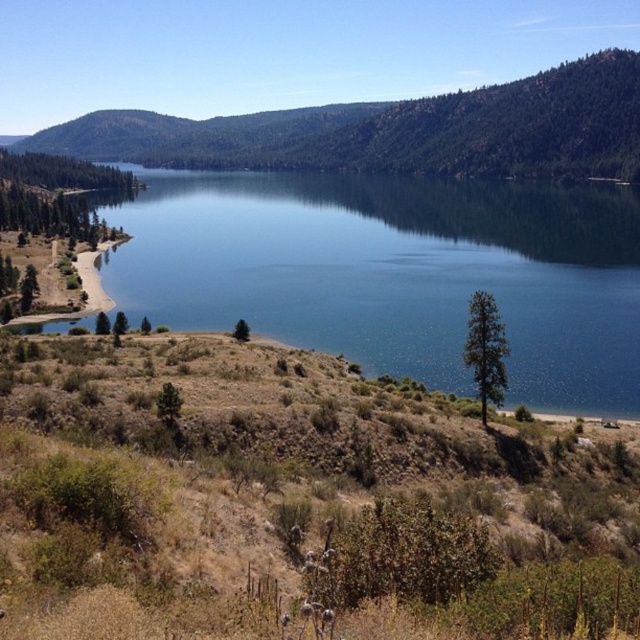
Question: Can you confirm if blue reflective water at center is smaller than green forested mountain at upper center?

Choices:
 (A) yes
 (B) no

Answer: (A)

Question: Which of the following is the farthest from the observer?

Choices:
 (A) blue reflective water at center
 (B) green forested mountain at upper center

Answer: (B)

Question: Is blue reflective water at center behind green forested mountain at upper center?

Choices:
 (A) yes
 (B) no

Answer: (B)

Question: Where is blue reflective water at center located in relation to green forested mountain at upper center in the image?

Choices:
 (A) left
 (B) right

Answer: (B)